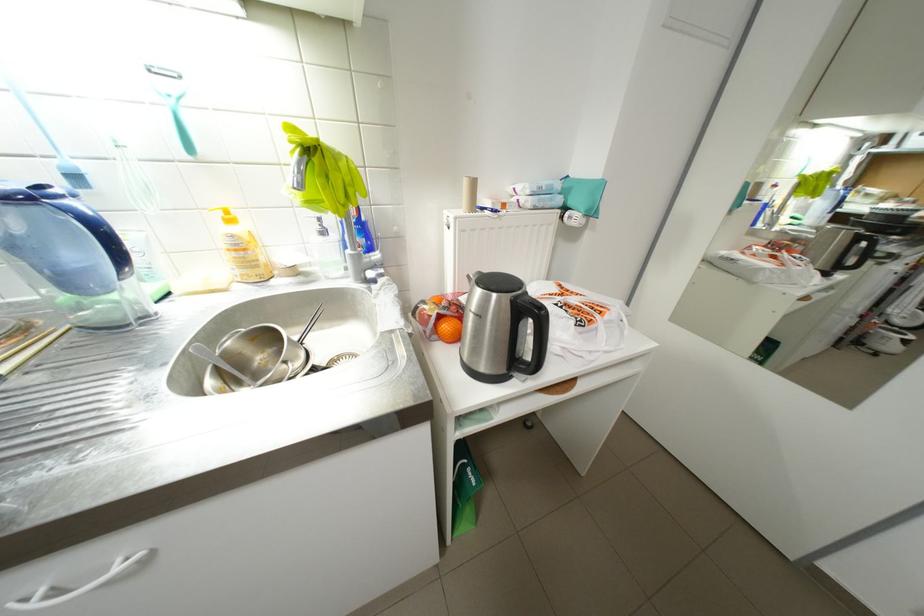
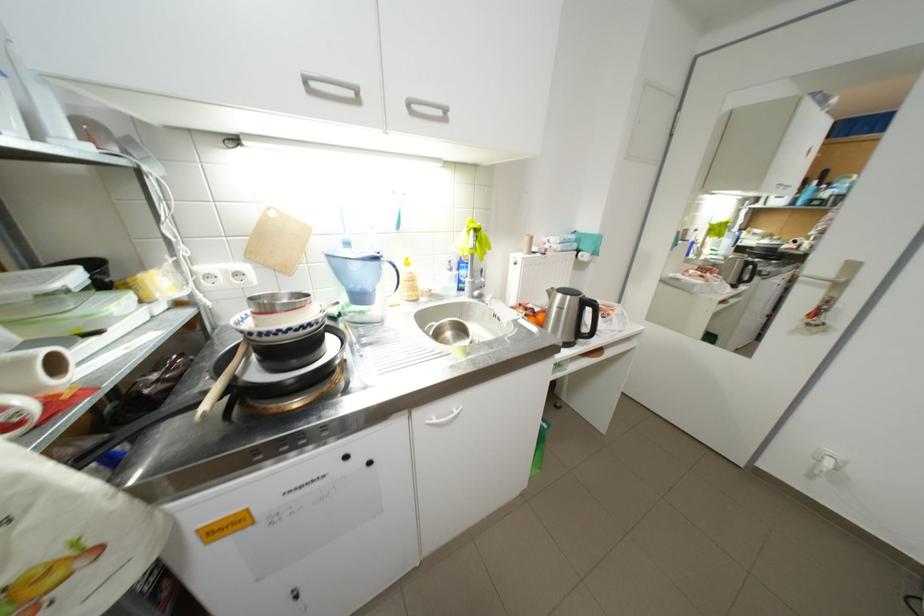
The point at (229, 353) is marked in the first image. Where is the corresponding point in the second image?

(443, 334)